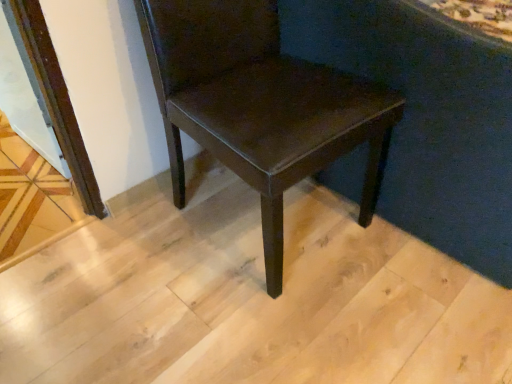
Describe the element at coordinates (258, 105) in the screenshot. The width and height of the screenshot is (512, 384). I see `matte dark brown chair at center` at that location.

This screenshot has height=384, width=512. I want to click on matte dark brown chair at center, so click(258, 105).

At what (x,y) coordinates should I click in order to perform the action: click on matte dark brown chair at center. Please return your answer as a coordinate pair (x, y). This screenshot has height=384, width=512. Looking at the image, I should click on (258, 105).